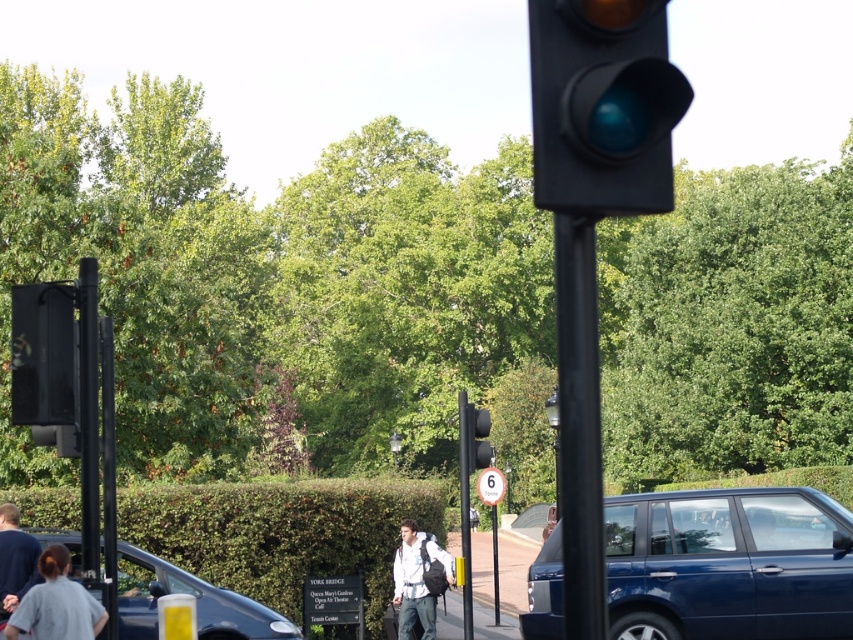
Question: Is light blue shirt at center above metallic pole at center?

Choices:
 (A) no
 (B) yes

Answer: (A)

Question: Which of the following is the farthest from the observer?

Choices:
 (A) green leafy hedge at lower center
 (B) matte black traffic light at upper right
 (C) black metal pole at center
 (D) light blue shirt at center

Answer: (A)

Question: From the image, what is the correct spatial relationship of shiny blue suv at lower right in relation to light blue shirt at center?

Choices:
 (A) below
 (B) above

Answer: (B)

Question: Which point is farther to the camera?

Choices:
 (A) (733, 557)
 (B) (467, 580)
 (C) (201, 545)

Answer: (C)

Question: Can you confirm if shiny blue suv at lower right is positioned to the left of light blue shirt at center?

Choices:
 (A) yes
 (B) no

Answer: (B)

Question: Based on their relative distances, which object is nearer to the dark blue shirt at lower left?

Choices:
 (A) metallic pole at center
 (B) green leafy hedge at lower center
 (C) light blue shirt at center

Answer: (C)